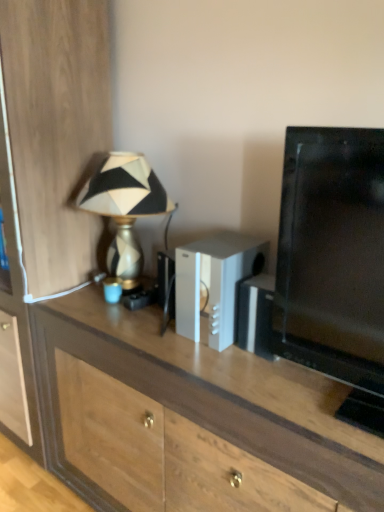
Question: Is gold textured lamp at left taller than wooden cabinet at left?

Choices:
 (A) yes
 (B) no

Answer: (B)

Question: Is the depth of gold textured lamp at left less than that of wooden cabinet at left?

Choices:
 (A) yes
 (B) no

Answer: (B)

Question: Is gold textured lamp at left facing away from wooden cabinet at left?

Choices:
 (A) no
 (B) yes

Answer: (A)

Question: Is gold textured lamp at left further to the viewer compared to wooden cabinet at left?

Choices:
 (A) no
 (B) yes

Answer: (B)

Question: From the image's perspective, is gold textured lamp at left under wooden cabinet at left?

Choices:
 (A) yes
 (B) no

Answer: (A)

Question: Is wooden cabinet at left in front of or behind gold textured lamp at left in the image?

Choices:
 (A) front
 (B) behind

Answer: (A)

Question: Looking at their shapes, would you say wooden cabinet at left is wider or thinner than gold textured lamp at left?

Choices:
 (A) wide
 (B) thin

Answer: (A)

Question: Do you think wooden cabinet at left is within gold textured lamp at left, or outside of it?

Choices:
 (A) inside
 (B) outside

Answer: (B)

Question: Considering the relative positions of wooden cabinet at left and gold textured lamp at left in the image provided, is wooden cabinet at left to the left or to the right of gold textured lamp at left?

Choices:
 (A) left
 (B) right

Answer: (A)

Question: Relative to silver metallic speaker at center, is wooden cabinet at left in front or behind?

Choices:
 (A) front
 (B) behind

Answer: (B)

Question: Considering the positions of wooden cabinet at left and silver metallic speaker at center in the image, is wooden cabinet at left bigger or smaller than silver metallic speaker at center?

Choices:
 (A) small
 (B) big

Answer: (B)

Question: Considering the positions of wooden cabinet at left and silver metallic speaker at center in the image, is wooden cabinet at left wider or thinner than silver metallic speaker at center?

Choices:
 (A) thin
 (B) wide

Answer: (B)

Question: From the image's perspective, is wooden cabinet at left located above or below silver metallic speaker at center?

Choices:
 (A) below
 (B) above

Answer: (B)

Question: Is gold textured lamp at left to the left or to the right of wooden cabinet at left in the image?

Choices:
 (A) left
 (B) right

Answer: (B)

Question: Which is correct: gold textured lamp at left is inside wooden cabinet at left, or outside of it?

Choices:
 (A) inside
 (B) outside

Answer: (B)